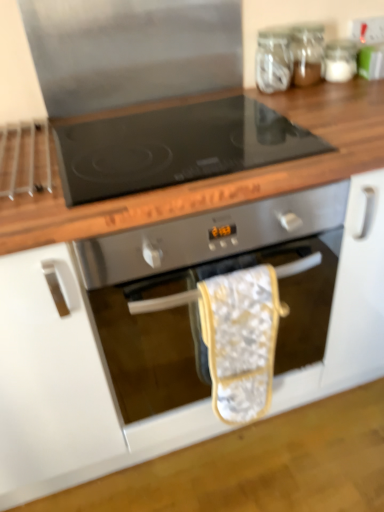
The height and width of the screenshot is (512, 384). I want to click on free spot to the right of transparent glass jar at upper right, positioned as the 3th glass jar in right-to-left order, so click(337, 91).